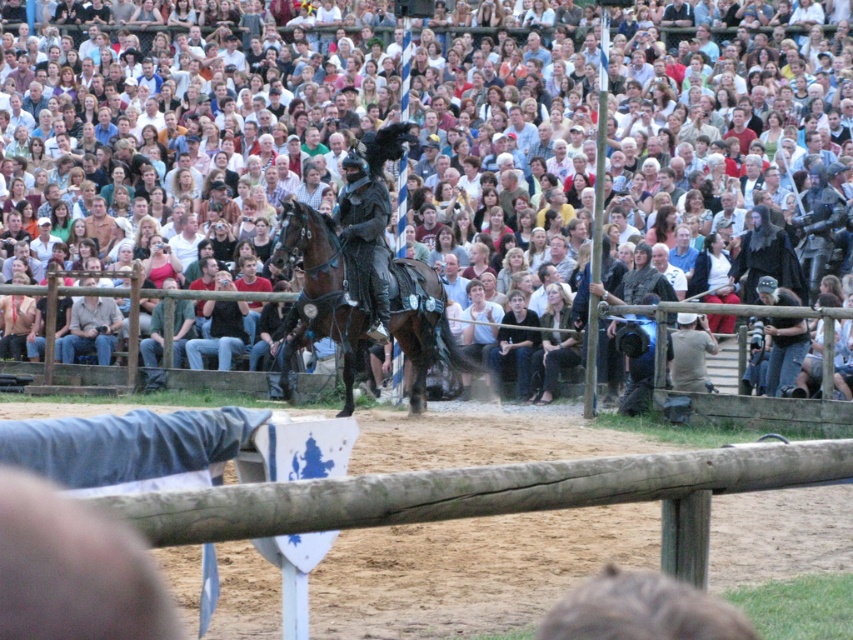
Looking at this image, is the position of white cotton shirt at center less distant than that of wooden at center?

No, white cotton shirt at center is further to the viewer.

Can you confirm if white cotton shirt at center is thinner than wooden at center?

No, white cotton shirt at center is not thinner than wooden at center.

Image resolution: width=853 pixels, height=640 pixels. What do you see at coordinates (558, 140) in the screenshot?
I see `white cotton shirt at center` at bounding box center [558, 140].

At what (x,y) coordinates should I click in order to perform the action: click on white cotton shirt at center. Please return your answer as a coordinate pair (x, y). The height and width of the screenshot is (640, 853). Looking at the image, I should click on (558, 140).

Can you confirm if white cotton shirt at center is wider than dark gray fabric at lower center?

Yes, white cotton shirt at center is wider than dark gray fabric at lower center.

Is point (215, 202) positioned in front of point (577, 358)?

No, (215, 202) is behind (577, 358).

Between point (579, 86) and point (550, 308), which one is positioned in front?

Point (550, 308) is in front.

Identify the location of white cotton shirt at center. [558, 140].

Who is lower down, white cotton shirt at center or shiny brown horse at center?

Positioned lower is shiny brown horse at center.

Does white cotton shirt at center appear over shiny brown horse at center?

Yes.

Locate an element on the screen. white cotton shirt at center is located at coordinates (558, 140).